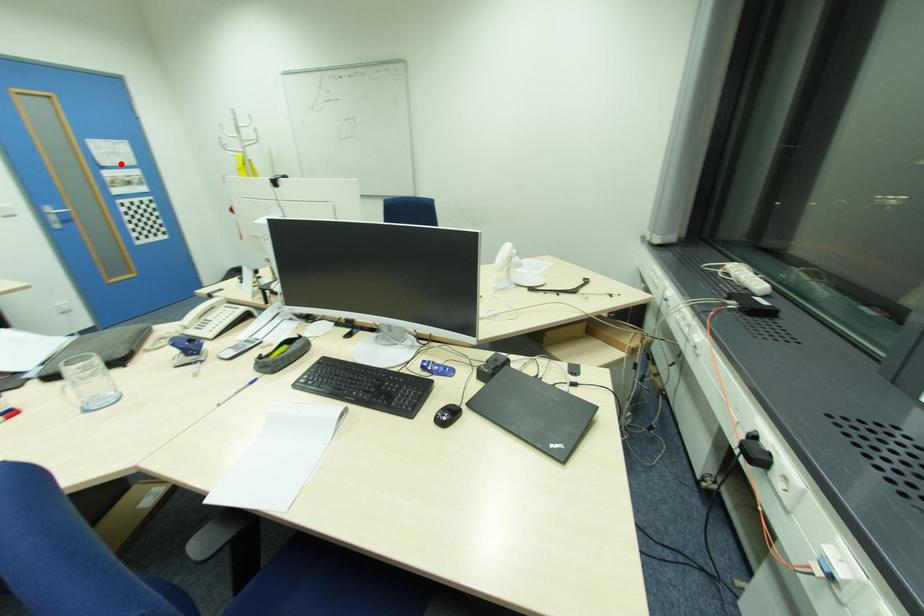
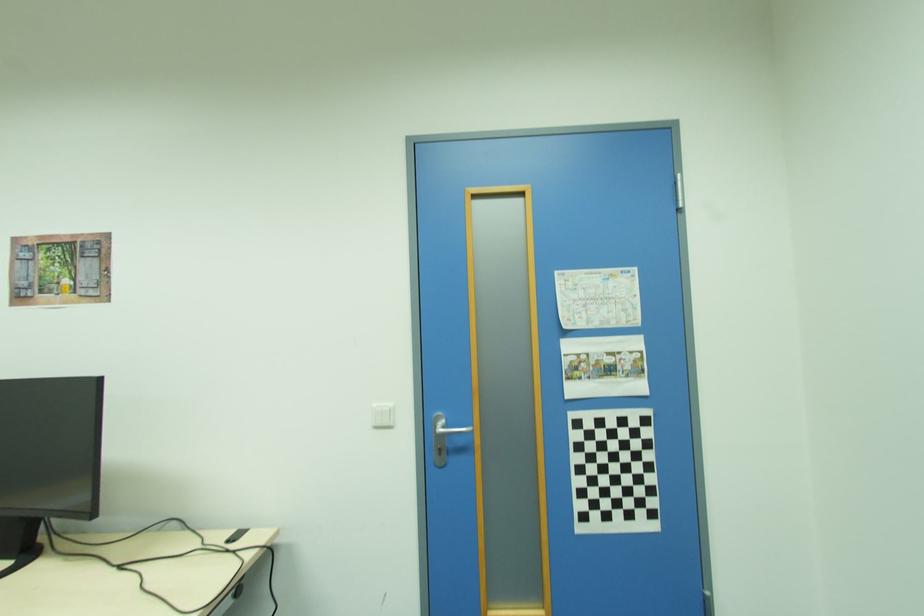
Question: I am providing you with two images of the same scene from different viewpoints. A red point is marked on the first image. At the location where the point appears in image 1, is it still visible in image 2?

Choices:
 (A) Yes
 (B) No

Answer: (A)